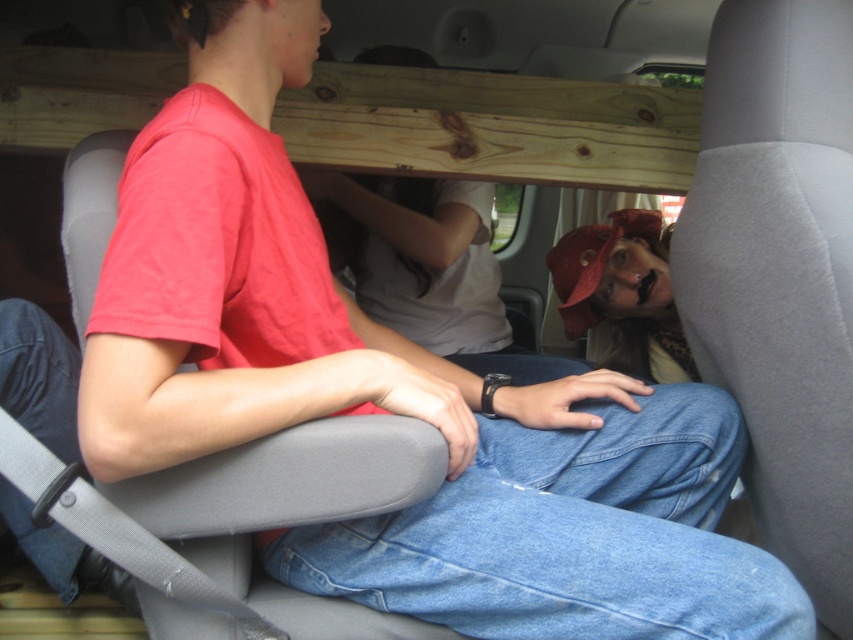
You are a passenger in the car and want to place a small backpack on the denim at center. Can you estimate the exact coordinates where you should place it?

The denim at center is located at coordinates (569,536), so you should place the backpack there.

You are standing at the backseat of the car and want to place a matte red cap exactly at the center of the backseat. Is the point you see at the center of the backseat the same as the point marked as point (624, 292)?

Yes, the point at (624, 292) is the center of the backseat where the matte red cap is located.